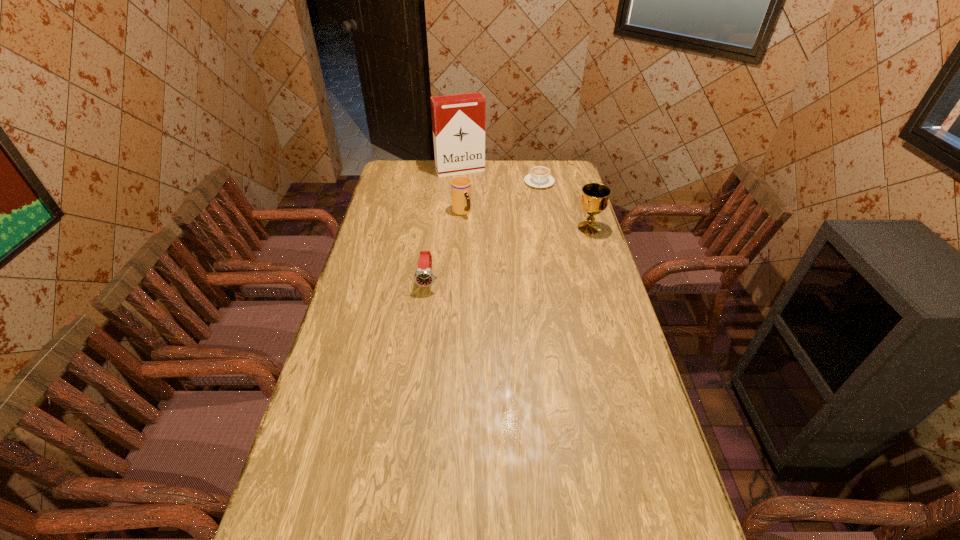
Image resolution: width=960 pixels, height=540 pixels. I want to click on vacant space located on the back of the fourth farthest object, so click(x=577, y=188).

Locate an element on the screen. This screenshot has height=540, width=960. free location located 0.190m on the side of the cappuccino with the handle is located at coordinates (535, 213).

You are a GUI agent. You are given a task and a screenshot of the screen. Output one action in this format:
    pyautogui.click(x=<x>, y=<y>)
    Task: Click on the free region located 0.080m on the side of the cappuccino with the handle
    This screenshot has height=540, width=960.
    Given the screenshot: What is the action you would take?
    pyautogui.click(x=537, y=199)

In order to click on vacant area situated on the side of the cappuccino with the handle in this screenshot , I will do `click(532, 240)`.

Find the location of a particular element. Image resolution: width=960 pixels, height=540 pixels. vacant space situated on the side of the third shortest object with the handle is located at coordinates (510, 269).

Where is `vacant region located 0.050m on the side of the third shortest object with the handle`? The image size is (960, 540). vacant region located 0.050m on the side of the third shortest object with the handle is located at coordinates (471, 225).

Locate an element on the screen. The width and height of the screenshot is (960, 540). vacant space located on the side of the third shortest object with the handle is located at coordinates (473, 227).

Locate an element on the screen. vacant space located on the front-facing side of the tallest object is located at coordinates (485, 215).

What are the coordinates of `vacant position located on the front-facing side of the tallest object` in the screenshot? It's located at [x=489, y=222].

Find the location of a particular element. The image size is (960, 540). free spot located 0.050m on the front-facing side of the tallest object is located at coordinates (468, 182).